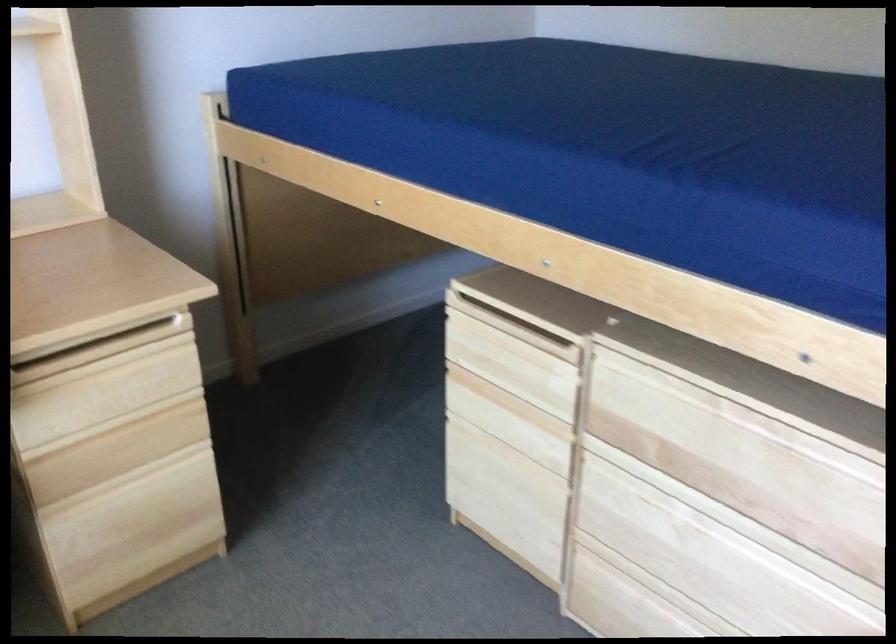
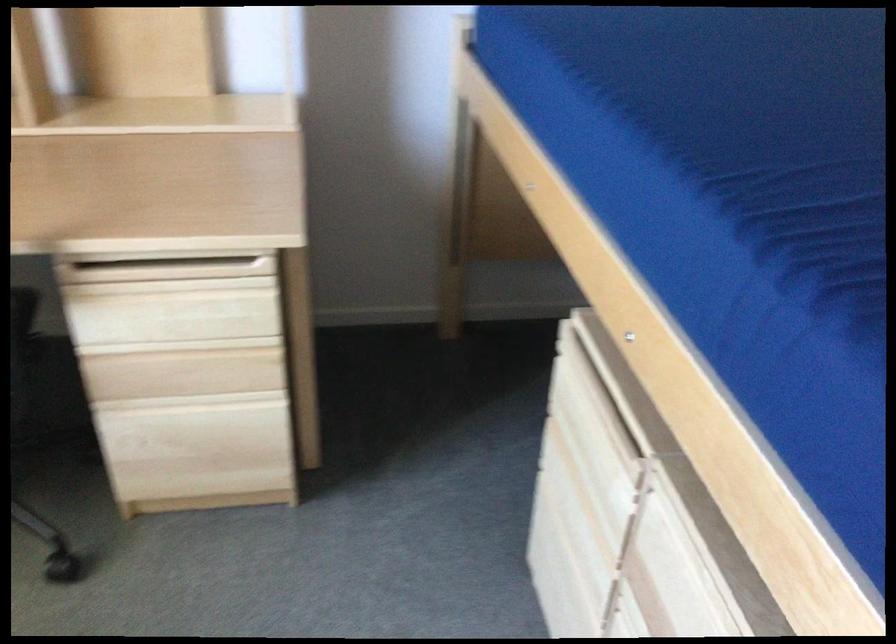
In the second image, find the point that corresponds to (132,474) in the first image.

(192, 401)